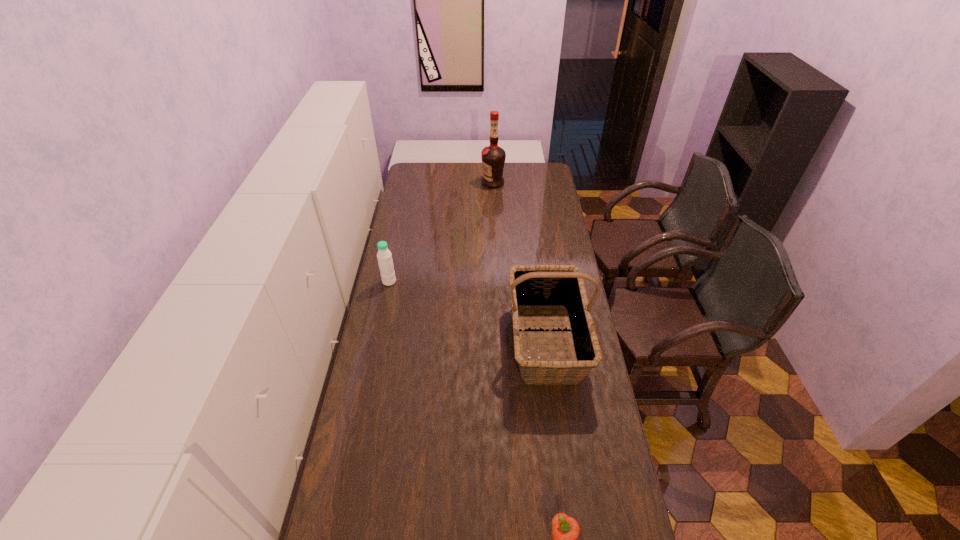
Where is `the farthest object`? The height and width of the screenshot is (540, 960). the farthest object is located at coordinates (493, 157).

Identify the location of the third shortest object. This screenshot has height=540, width=960. (554, 287).

Locate an element on the screen. This screenshot has height=540, width=960. basket is located at coordinates (554, 287).

You are a GUI agent. You are given a task and a screenshot of the screen. Output one action in this format:
    pyautogui.click(x=<x>, y=<y>)
    Task: Click on the second farthest object
    Image resolution: width=960 pixels, height=540 pixels.
    Given the screenshot: What is the action you would take?
    pyautogui.click(x=384, y=256)

Identify the location of the leftmost object. (384, 256).

In order to click on vacant space situated 0.140m on the front and back of the liquor in this screenshot , I will do `click(457, 183)`.

Identify the location of free space located 0.220m on the front and back of the liquor. tap(443, 183).

The height and width of the screenshot is (540, 960). In order to click on free space located on the front and back of the liquor in this screenshot , I will do click(439, 183).

The height and width of the screenshot is (540, 960). I want to click on vacant region located 0.160m by the handle of the third shortest object, so click(x=560, y=441).

You are a GUI agent. You are given a task and a screenshot of the screen. Output one action in this format:
    pyautogui.click(x=<x>, y=<y>)
    Task: Click on the free region located on the right of the third tallest object
    
    Given the screenshot: What is the action you would take?
    (x=423, y=281)